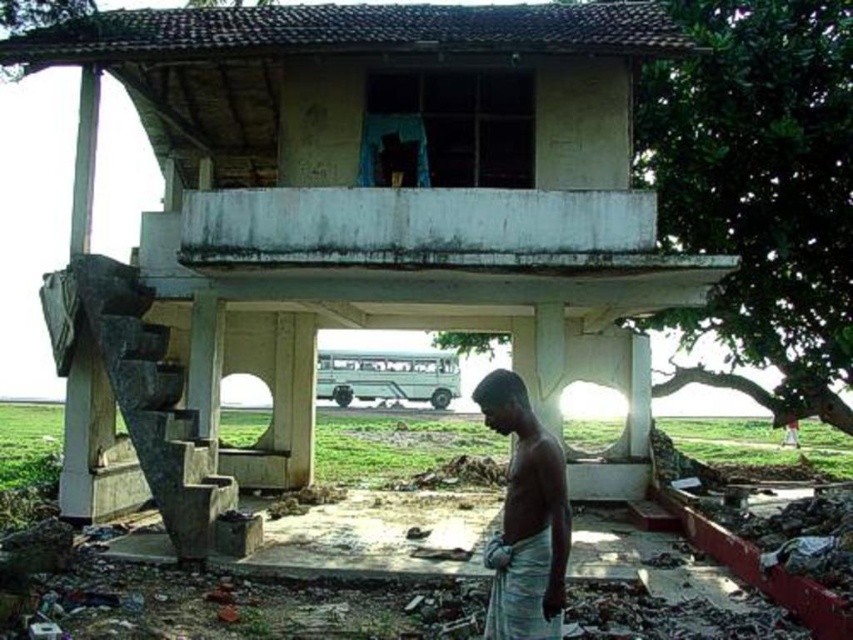
Question: Which object is positioned closest to the light brown cloth at center?

Choices:
 (A) green leafy tree at center
 (B) green leafy tree at upper right

Answer: (B)

Question: Which of the following is the farthest from the observer?

Choices:
 (A) green leafy tree at upper right
 (B) light brown cloth at center
 (C) green leafy tree at center

Answer: (C)

Question: Is green leafy tree at upper right below light brown cloth at center?

Choices:
 (A) yes
 (B) no

Answer: (B)

Question: Considering the real-world distances, which object is closest to the light brown cloth at center?

Choices:
 (A) green leafy tree at upper right
 (B) green leafy tree at center

Answer: (A)

Question: From the image, what is the correct spatial relationship of green leafy tree at upper right in relation to light brown cloth at center?

Choices:
 (A) right
 (B) left

Answer: (A)

Question: Observing the image, what is the correct spatial positioning of green leafy tree at upper right in reference to light brown cloth at center?

Choices:
 (A) right
 (B) left

Answer: (A)